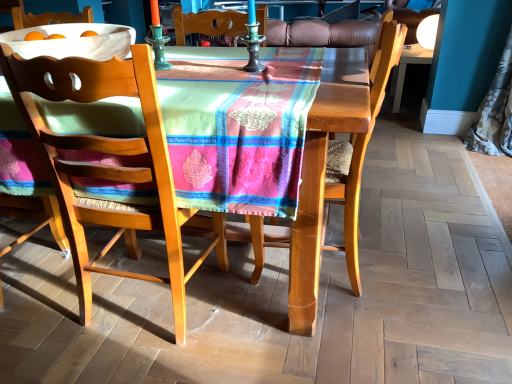
Question: From the image's perspective, is wooden chair at center, the first chair viewed from the right, located beneath wooden chair with woven seat at center, arranged as the first chair when viewed from the left?

Choices:
 (A) yes
 (B) no

Answer: (B)

Question: Is wooden chair at center, arranged as the second chair when viewed from the left, turned away from wooden chair with woven seat at center, arranged as the first chair when viewed from the left?

Choices:
 (A) no
 (B) yes

Answer: (A)

Question: Is wooden chair with woven seat at center, the second chair positioned from the right, located within wooden chair at center, arranged as the second chair when viewed from the left?

Choices:
 (A) yes
 (B) no

Answer: (B)

Question: Can you confirm if wooden chair at center, the first chair viewed from the right, is positioned to the left of wooden chair with woven seat at center, the second chair positioned from the right?

Choices:
 (A) no
 (B) yes

Answer: (A)

Question: From a real-world perspective, is wooden chair at center, arranged as the second chair when viewed from the left, beneath wooden chair with woven seat at center, arranged as the first chair when viewed from the left?

Choices:
 (A) yes
 (B) no

Answer: (B)

Question: Considering their positions, is wooden chair at center, arranged as the second chair when viewed from the left, located in front of or behind wooden chair with woven seat at center, arranged as the first chair when viewed from the left?

Choices:
 (A) front
 (B) behind

Answer: (B)

Question: Is point (279, 228) closer or farther from the camera than point (182, 274)?

Choices:
 (A) closer
 (B) farther

Answer: (B)

Question: Considering the positions of wooden chair at center, arranged as the second chair when viewed from the left, and wooden chair with woven seat at center, arranged as the first chair when viewed from the left, in the image, is wooden chair at center, arranged as the second chair when viewed from the left, bigger or smaller than wooden chair with woven seat at center, arranged as the first chair when viewed from the left,?

Choices:
 (A) big
 (B) small

Answer: (B)

Question: From the image's perspective, is wooden chair at center, the first chair viewed from the right, located above or below wooden chair with woven seat at center, arranged as the first chair when viewed from the left?

Choices:
 (A) above
 (B) below

Answer: (A)

Question: Considering their positions, is silky floral curtain at right located in front of or behind wooden chair with woven seat at center, arranged as the first chair when viewed from the left?

Choices:
 (A) front
 (B) behind

Answer: (B)

Question: In terms of width, does silky floral curtain at right look wider or thinner when compared to wooden chair with woven seat at center, arranged as the first chair when viewed from the left?

Choices:
 (A) wide
 (B) thin

Answer: (B)

Question: From their relative heights in the image, would you say silky floral curtain at right is taller or shorter than wooden chair with woven seat at center, arranged as the first chair when viewed from the left?

Choices:
 (A) tall
 (B) short

Answer: (A)

Question: Considering the relative positions of silky floral curtain at right and wooden chair with woven seat at center, arranged as the first chair when viewed from the left, in the image provided, is silky floral curtain at right to the left or to the right of wooden chair with woven seat at center, arranged as the first chair when viewed from the left,?

Choices:
 (A) left
 (B) right

Answer: (B)

Question: From a real-world perspective, is matte black desk at upper right physically located above or below wooden chair with woven seat at center, the second chair positioned from the right?

Choices:
 (A) above
 (B) below

Answer: (B)

Question: Is matte black desk at upper right taller or shorter than wooden chair with woven seat at center, the second chair positioned from the right?

Choices:
 (A) short
 (B) tall

Answer: (A)